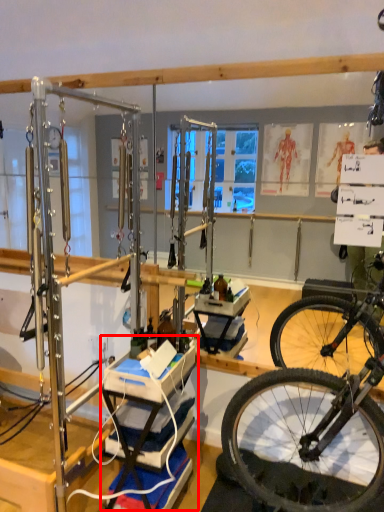
Question: Observing the image, what is the correct spatial positioning of workbench (annotated by the red box) in reference to yoga mat?

Choices:
 (A) left
 (B) right

Answer: (B)